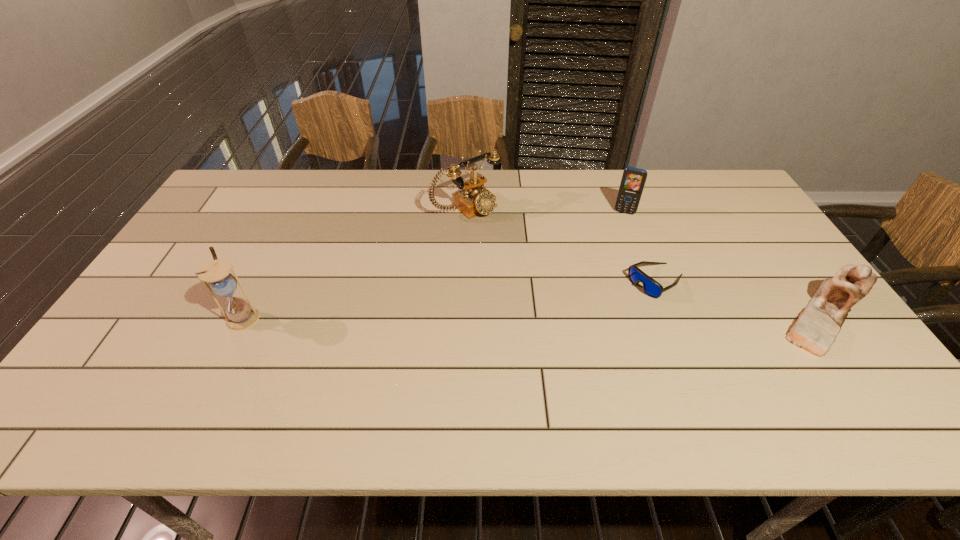
The height and width of the screenshot is (540, 960). What are the coordinates of `the leftmost object` in the screenshot? It's located at (240, 315).

You are a GUI agent. You are given a task and a screenshot of the screen. Output one action in this format:
    pyautogui.click(x=<x>, y=<y>)
    Task: Click on the figurine
    
    Given the screenshot: What is the action you would take?
    [x=815, y=330]

This screenshot has width=960, height=540. In order to click on cellular telephone in this screenshot , I will do `click(633, 180)`.

Where is `sunglasses`? The height and width of the screenshot is (540, 960). sunglasses is located at coordinates (651, 287).

You are a GUI agent. You are given a task and a screenshot of the screen. Output one action in this format:
    pyautogui.click(x=<x>, y=<y>)
    Task: Click on the telephone
    This screenshot has width=960, height=540.
    Given the screenshot: What is the action you would take?
    pyautogui.click(x=475, y=199)

Locate an element on the screen. This screenshot has width=960, height=540. free location located 0.200m on the left of the leftmost object is located at coordinates (151, 316).

Find the location of `vacant region located 0.080m on the front-facing side of the rightmost object`. vacant region located 0.080m on the front-facing side of the rightmost object is located at coordinates (741, 316).

This screenshot has height=540, width=960. Find the location of `vacant space located on the front-facing side of the rightmost object`. vacant space located on the front-facing side of the rightmost object is located at coordinates (741, 316).

Locate an element on the screen. vacant space located on the front-facing side of the rightmost object is located at coordinates (641, 316).

What are the coordinates of `vacant region located 0.070m on the screen of the cellular telephone` in the screenshot? It's located at (618, 228).